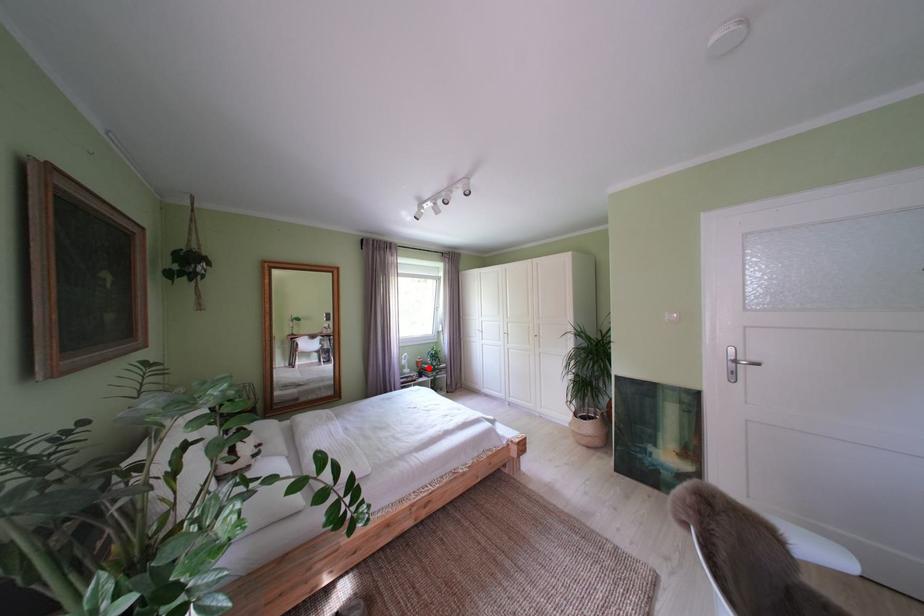
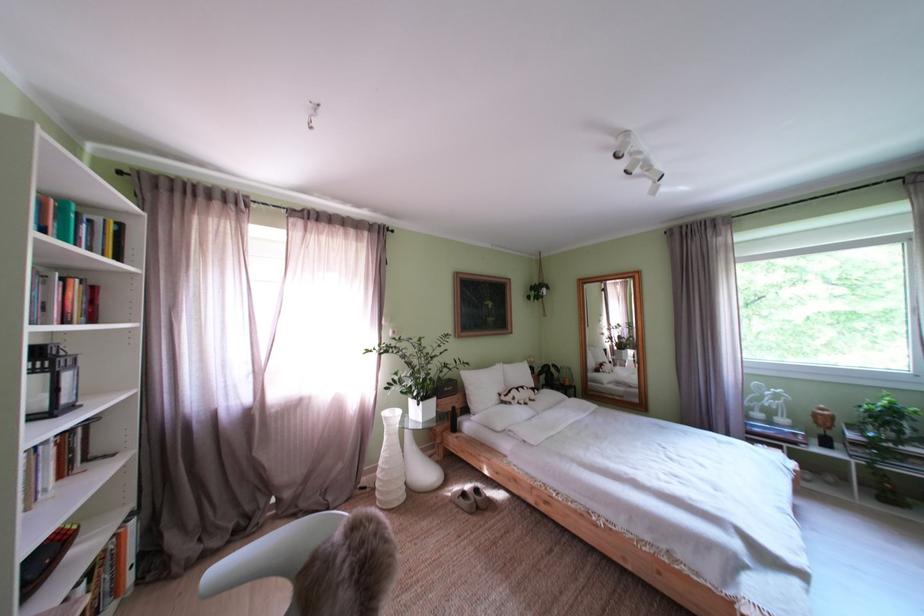
Question: A red point is marked in image1. In image2, is the corresponding 3D point closer to the camera or farther? Reply with the corresponding letter.

Choices:
 (A) The corresponding 3D point is closer.
 (B) The corresponding 3D point is farther.

Answer: (A)